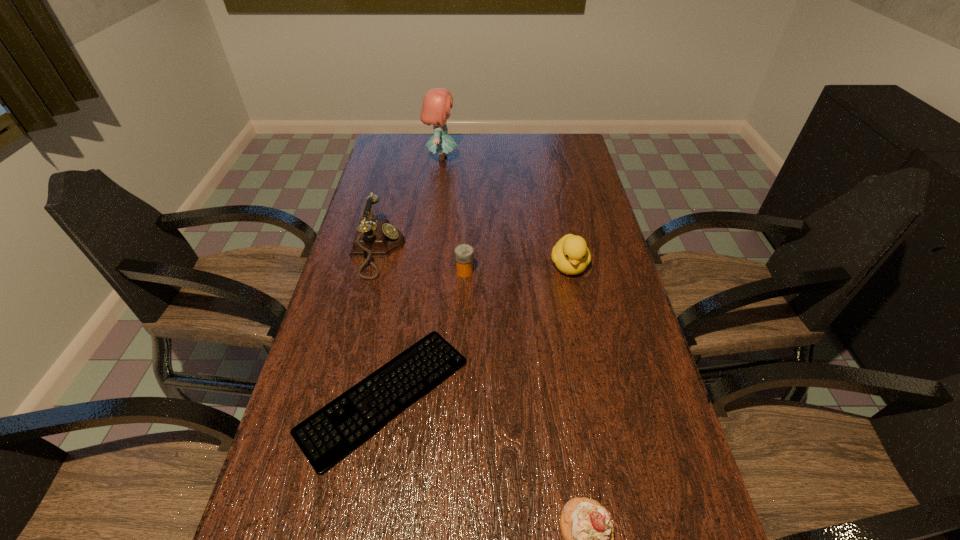
This screenshot has height=540, width=960. In order to click on blank space located 0.220m on the label side of the second shortest object in this screenshot , I will do `click(549, 272)`.

Locate an element on the screen. vacant space located on the back of the shortest object is located at coordinates (405, 273).

At what (x,y) coordinates should I click in order to perform the action: click on object situated at the far edge. Please return your answer as a coordinate pair (x, y). Looking at the image, I should click on coord(436,106).

Find the location of a particular element. The height and width of the screenshot is (540, 960). telephone that is at the left edge is located at coordinates (375, 237).

In order to click on computer keyboard located in the left edge section of the desktop in this screenshot , I will do `click(328, 436)`.

Find the location of a particular element. Image resolution: width=960 pixels, height=540 pixels. object at the right edge is located at coordinates click(571, 256).

This screenshot has height=540, width=960. Identify the location of vacant space at the far edge of the desktop. (461, 145).

Locate an element on the screen. The height and width of the screenshot is (540, 960). free space at the left edge of the desktop is located at coordinates (370, 195).

This screenshot has width=960, height=540. Find the location of `free space at the right edge of the desktop`. free space at the right edge of the desktop is located at coordinates (580, 230).

You are a GUI agent. You are given a task and a screenshot of the screen. Output one action in this format:
    pyautogui.click(x=<x>, y=<y>)
    Task: Click on the vacant space at the far left corner of the desktop
    The width and height of the screenshot is (960, 540).
    Given the screenshot: What is the action you would take?
    pyautogui.click(x=403, y=157)